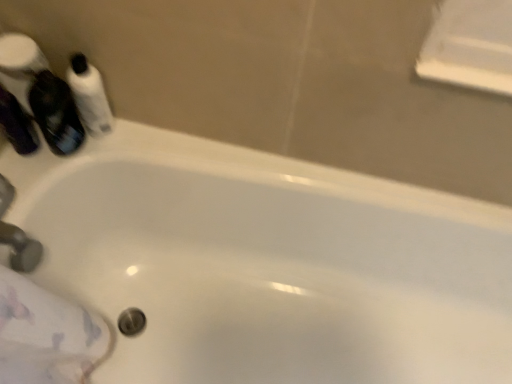
Question: In terms of size, does translucent purple mouthwash at upper left, positioned as the 2th mouthwash in right-to-left order, appear bigger or smaller than matte silver faucet at lower left?

Choices:
 (A) big
 (B) small

Answer: (A)

Question: From the image's perspective, is translucent purple mouthwash at upper left, positioned as the 2th mouthwash in right-to-left order, above or below matte silver faucet at lower left?

Choices:
 (A) above
 (B) below

Answer: (A)

Question: Considering the real-world distances, which object is farthest from the matte black bottle at left, the 1th mouthwash viewed from the left?

Choices:
 (A) matte silver faucet at lower left
 (B) white glossy mouthwash at upper left, the first mouthwash viewed from the right
 (C) translucent purple mouthwash at upper left, positioned as the 2th mouthwash in right-to-left order

Answer: (A)

Question: Which of these objects is positioned closest to the matte black bottle at left, the 1th mouthwash viewed from the left?

Choices:
 (A) white glossy mouthwash at upper left, the first mouthwash viewed from the right
 (B) matte silver faucet at lower left
 (C) translucent purple mouthwash at upper left, which is the second mouthwash from left to right

Answer: (C)